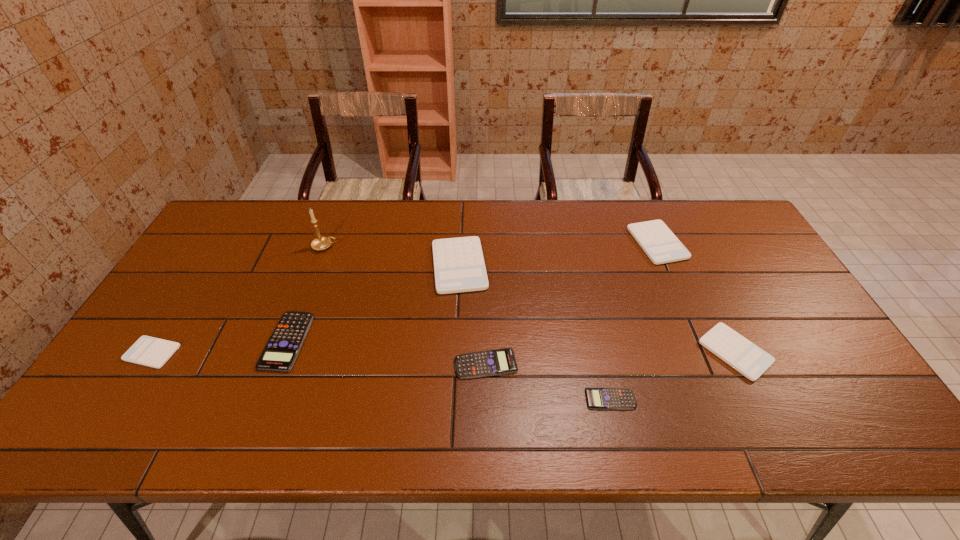
Find the location of a particular element. The height and width of the screenshot is (540, 960). the biggest blue calculator is located at coordinates (281, 351).

Locate an element on the screen. The width and height of the screenshot is (960, 540). the leftmost blue calculator is located at coordinates (281, 351).

I want to click on the second smallest blue calculator, so click(x=495, y=362).

The image size is (960, 540). Find the location of `the second blue calculator from right to left`. the second blue calculator from right to left is located at coordinates (495, 362).

Locate an element on the screen. Image resolution: width=960 pixels, height=540 pixels. the rightmost blue calculator is located at coordinates pos(597,398).

Find the location of a particular element. This screenshot has width=960, height=540. the shortest calculator is located at coordinates (597, 398).

At what (x,y) coordinates should I click in order to perform the action: click on free location located on the handle side of the candle holder. Please return your answer as a coordinate pair (x, y). This screenshot has width=960, height=540. Looking at the image, I should click on (378, 246).

Where is `free space located 0.070m on the right of the biggest white calculator`? free space located 0.070m on the right of the biggest white calculator is located at coordinates (511, 266).

You are a GUI agent. You are given a task and a screenshot of the screen. Output one action in this format:
    pyautogui.click(x=<x>, y=<y>)
    Task: Click on the free space located 0.320m on the front of the second tallest calculator
    This screenshot has width=960, height=540.
    Given the screenshot: What is the action you would take?
    click(704, 350)

In order to click on free location located on the right of the fifth shortest object in this screenshot , I will do `click(822, 352)`.